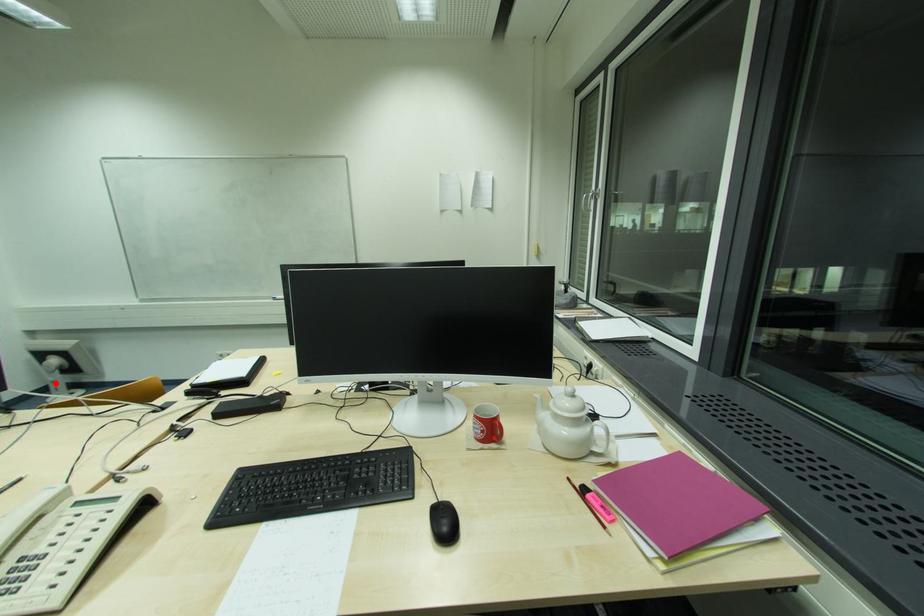
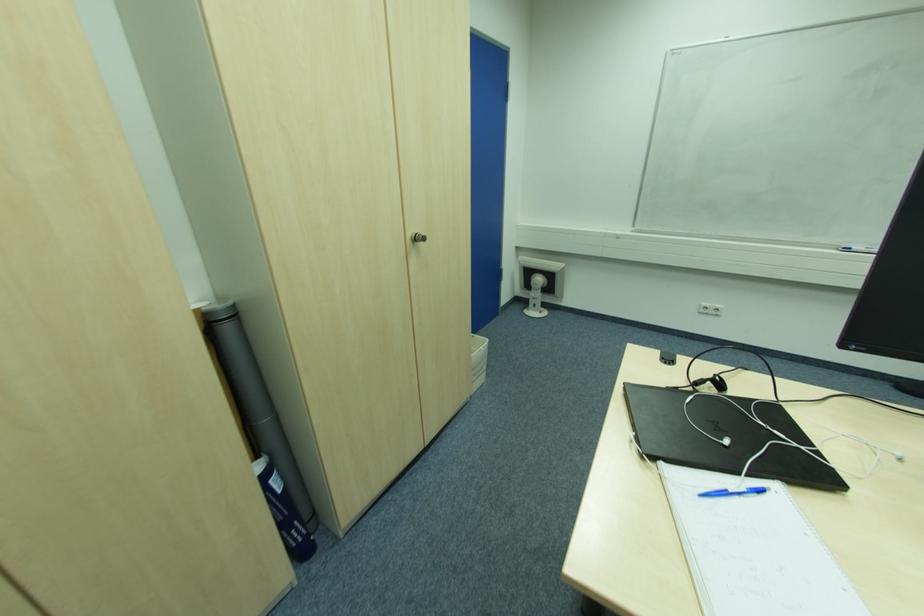
In the second image, find the point that corresponds to the highlighted location in the first image.

(536, 300)